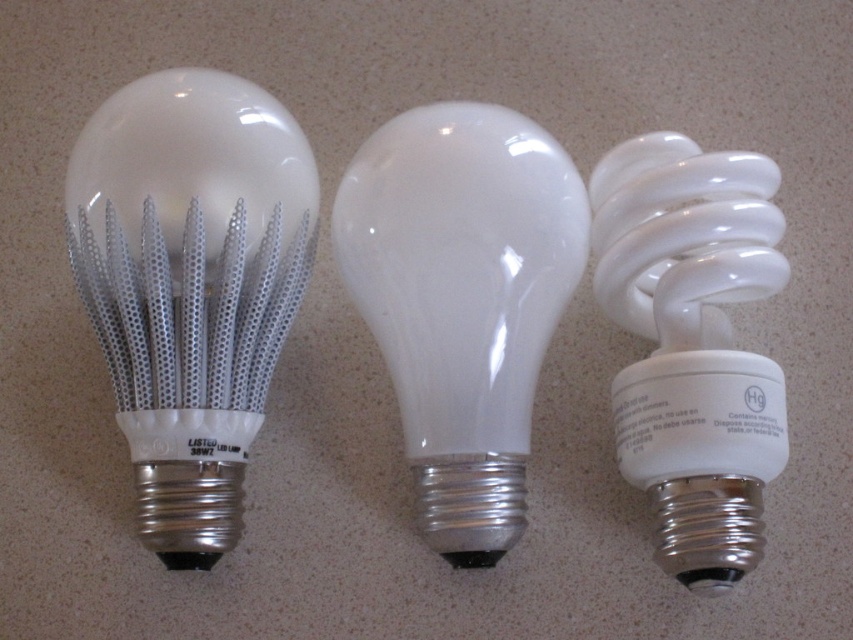
Question: From the image, what is the correct spatial relationship of white metallic led bulb at left in relation to matte white bulb at center?

Choices:
 (A) below
 (B) above

Answer: (B)

Question: Which of these objects is positioned farthest from the white glossy spiral bulb at right?

Choices:
 (A) matte white bulb at center
 (B) white metallic led bulb at left

Answer: (B)

Question: Observing the image, what is the correct spatial positioning of white metallic led bulb at left in reference to matte white bulb at center?

Choices:
 (A) right
 (B) left

Answer: (B)

Question: Which object is positioned closest to the white glossy spiral bulb at right?

Choices:
 (A) matte white bulb at center
 (B) white metallic led bulb at left

Answer: (A)

Question: Estimate the real-world distances between objects in this image. Which object is closer to the white glossy spiral bulb at right?

Choices:
 (A) white metallic led bulb at left
 (B) matte white bulb at center

Answer: (B)

Question: Can you confirm if white metallic led bulb at left is bigger than white glossy spiral bulb at right?

Choices:
 (A) yes
 (B) no

Answer: (A)